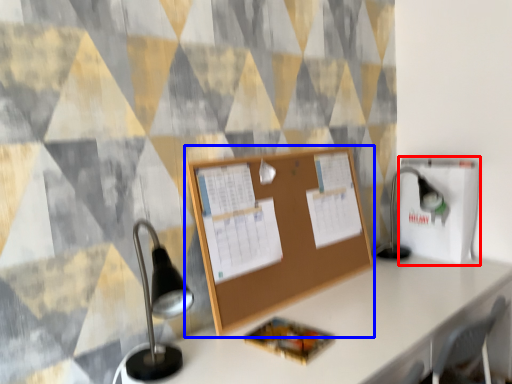
Question: Which object appears farthest to the camera in this image, cardboard box (highlighted by a red box) or bulletin board (highlighted by a blue box)?

Choices:
 (A) cardboard box
 (B) bulletin board

Answer: (A)